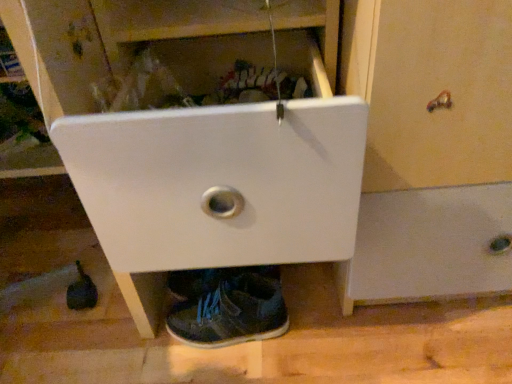
You are a GUI agent. You are given a task and a screenshot of the screen. Output one action in this format:
    pyautogui.click(x=<x>, y=<y>)
    Task: Click on the spots to the right of dark blue canvas shoe at lower center
    This screenshot has height=384, width=512.
    Given the screenshot: What is the action you would take?
    pyautogui.click(x=322, y=323)